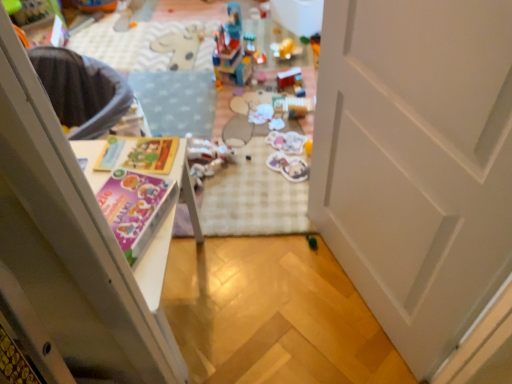
The height and width of the screenshot is (384, 512). Identify the location of blank area to the left of translucent plastic stickers at center, the 4th toy from the bottom. (248, 143).